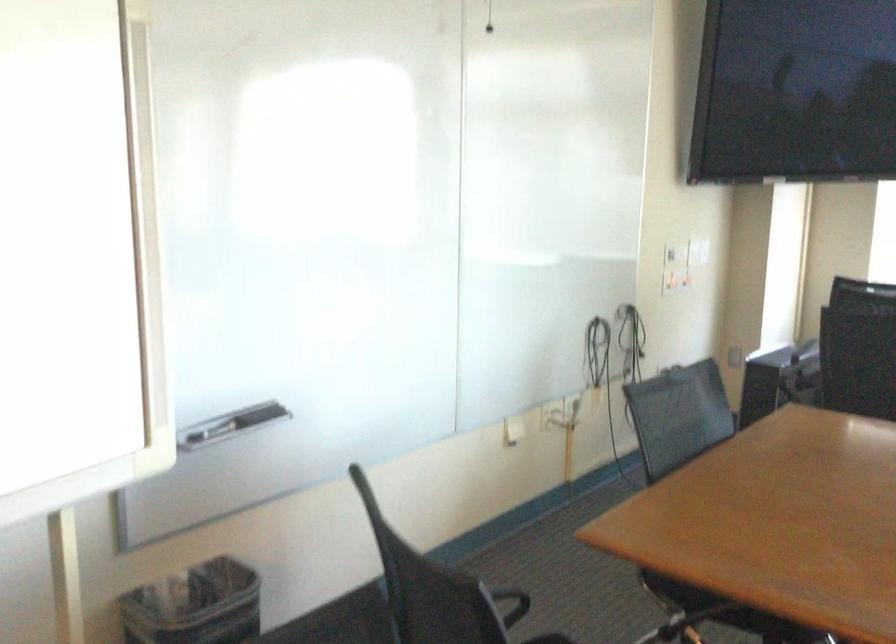
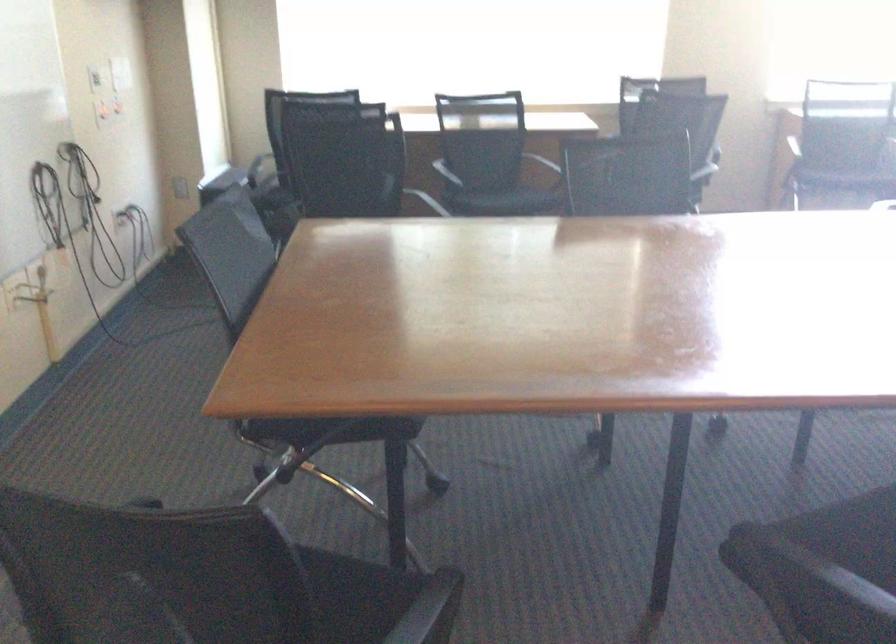
Question: The images are taken continuously from a first-person perspective. In which direction is your viewpoint rotating?

Choices:
 (A) Left
 (B) Right
 (C) Up
 (D) Down

Answer: (B)